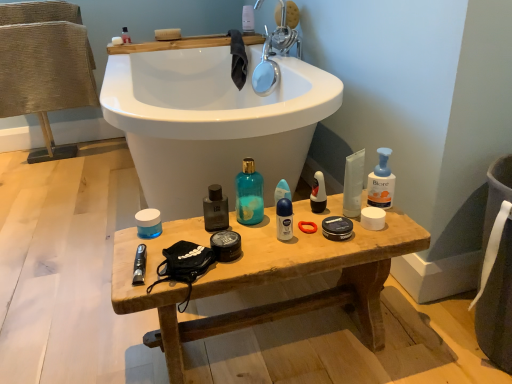
Locate an element on the screen. free region on the left part of matte black deodorant at center, marked as the 5th toiletry in a bottom-to-top arrangement is located at coordinates (270, 220).